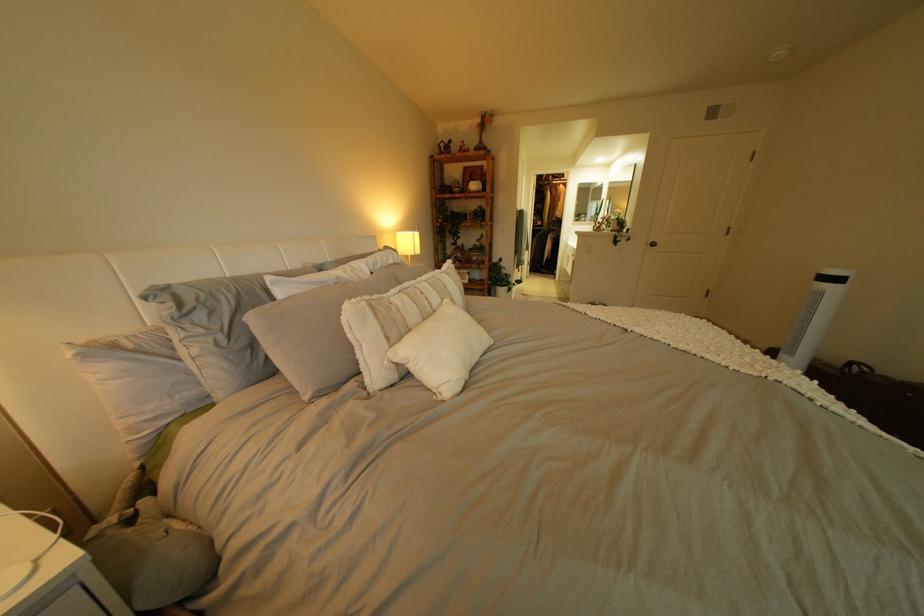
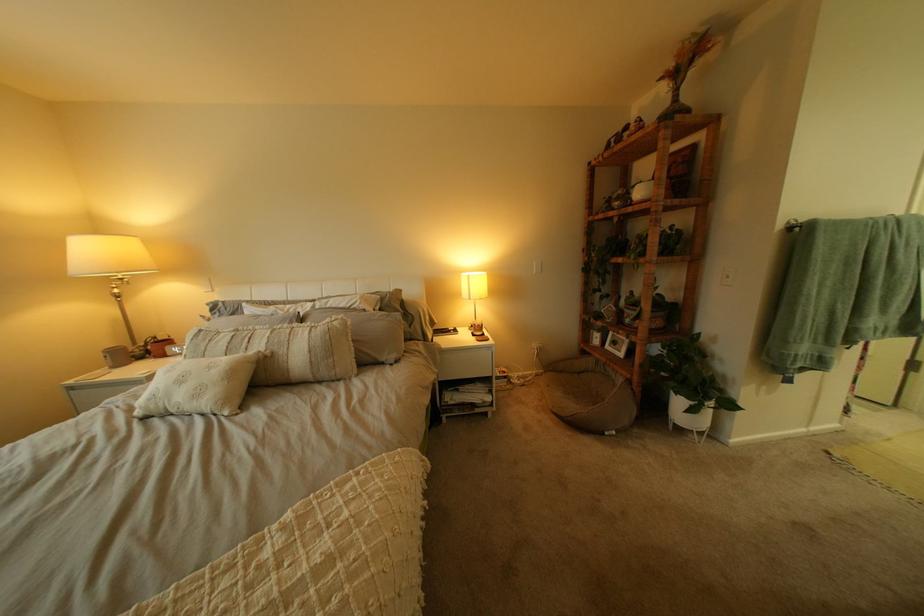
Find the pixel in the second image that matches (x=515, y=284) in the first image.

(687, 385)